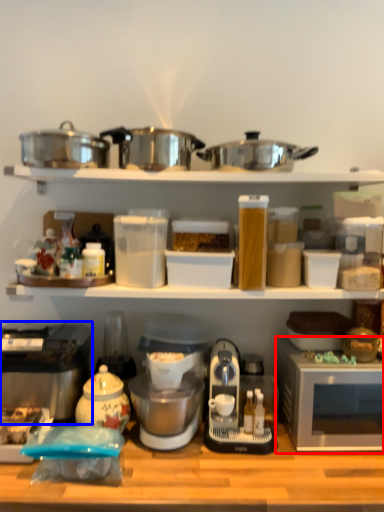
Question: Which of the following is the farthest to the observer, microwave oven (highlighted by a red box) or home appliance (highlighted by a blue box)?

Choices:
 (A) microwave oven
 (B) home appliance

Answer: (B)